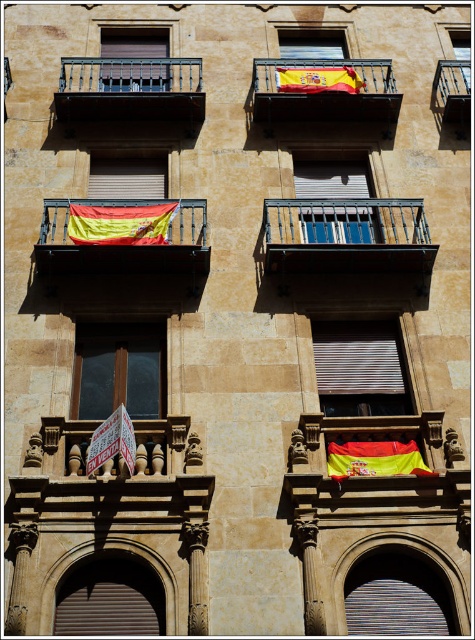
Which of these two, wooden carved balcony at center or red and yellow fabric flag at lower center, stands taller?

red and yellow fabric flag at lower center is taller.

Which is in front, point (60, 429) or point (399, 467)?

Point (399, 467) is more forward.

Between point (37, 477) and point (391, 454), which one is positioned behind?

The point (391, 454) is more distant.

The height and width of the screenshot is (640, 475). What are the coordinates of `wooden carved balcony at center` in the screenshot? It's located at (116, 464).

Can you confirm if matte glass window at center is positioned to the right of matte metal balcony at left?

Correct, you'll find matte glass window at center to the right of matte metal balcony at left.

Who is more forward, (157,362) or (135,202)?

Positioned in front is point (157,362).

Does point (113, 376) come in front of point (117, 205)?

Yes, it is.

What are the coordinates of `matte glass window at center` in the screenshot? It's located at (120, 369).

Which is more to the left, matte glass window at center or red fabric flag at upper center?

Positioned to the left is red fabric flag at upper center.

Does matte glass window at center appear on the right side of red fabric flag at upper center?

Correct, you'll find matte glass window at center to the right of red fabric flag at upper center.

Measure the distance between point (130, 394) and camera.

Point (130, 394) and camera are 44.43 meters apart.

Where is `matte glass window at center`? This screenshot has width=475, height=640. matte glass window at center is located at coordinates (120, 369).